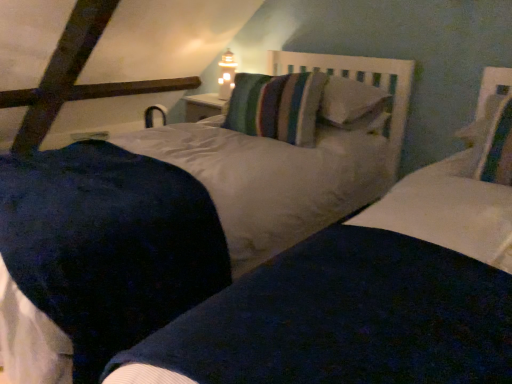
Question: Should I look upward or downward to see white ceramic light fixture at upper center?

Choices:
 (A) up
 (B) down

Answer: (A)